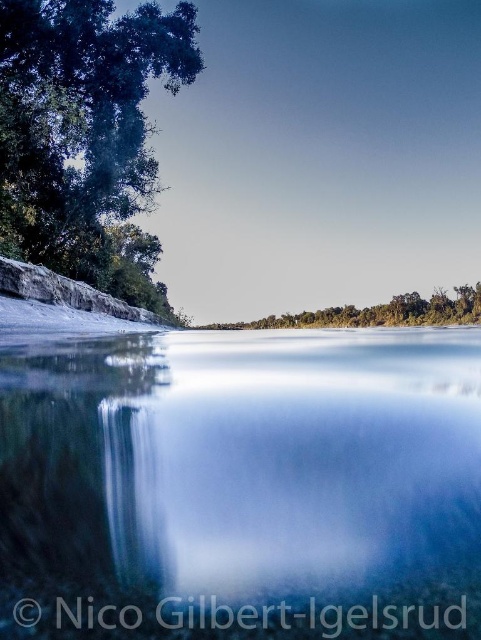
This screenshot has width=481, height=640. I want to click on green leafy tree at upper left, so click(80, 122).

Looking at this image, which is more to the left, green leafy tree at upper left or green leafy trees at center?

Positioned to the left is green leafy tree at upper left.

Which is in front, point (111, 182) or point (403, 301)?

Point (111, 182)

Image resolution: width=481 pixels, height=640 pixels. In order to click on green leafy tree at upper left in this screenshot , I will do `click(80, 122)`.

Can you confirm if clear glass water at center is bigger than green leafy trees at center?

Actually, clear glass water at center might be smaller than green leafy trees at center.

Who is positioned more to the right, clear glass water at center or green leafy trees at center?

green leafy trees at center is more to the right.

The width and height of the screenshot is (481, 640). I want to click on clear glass water at center, so click(x=242, y=486).

Identify the location of clear glass water at center. The height and width of the screenshot is (640, 481). (242, 486).

Between clear glass water at center and green leafy tree at upper left, which one is positioned higher?

green leafy tree at upper left

Who is positioned more to the left, clear glass water at center or green leafy tree at upper left?

green leafy tree at upper left

Image resolution: width=481 pixels, height=640 pixels. Describe the element at coordinates (242, 486) in the screenshot. I see `clear glass water at center` at that location.

What are the coordinates of `clear glass water at center` in the screenshot? It's located at (242, 486).